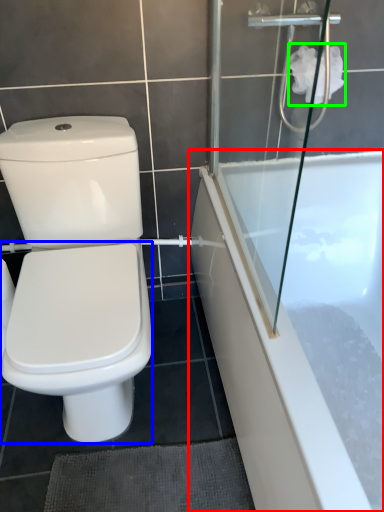
Question: Which is nearer to the bathtub (highlighted by a red box)? bidet (highlighted by a blue box) or toilet paper (highlighted by a green box).

Choices:
 (A) bidet
 (B) toilet paper

Answer: (A)